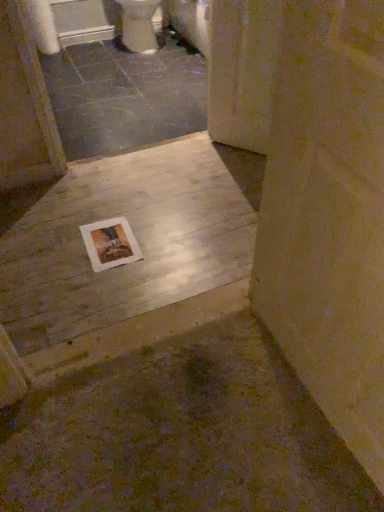
You are a GUI agent. You are given a task and a screenshot of the screen. Output one action in this format:
    pyautogui.click(x=<x>, y=<y>)
    Task: Click on the empty space that is ontop of wooden floor at center, which is the 2th concrete in back-to-front order
    The image size is (384, 512).
    Given the screenshot: What is the action you would take?
    pyautogui.click(x=142, y=229)